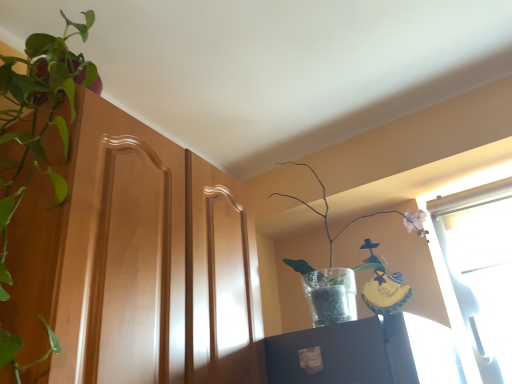
Question: Is translucent glass vase at upper right, the 2th houseplant viewed from the left, surrounding green leafy plant at left, arranged as the 2th houseplant when viewed from the right?

Choices:
 (A) yes
 (B) no

Answer: (B)

Question: Can you confirm if translucent glass vase at upper right, the 2th houseplant viewed from the left, is thinner than green leafy plant at left, arranged as the 2th houseplant when viewed from the right?

Choices:
 (A) yes
 (B) no

Answer: (B)

Question: Is translucent glass vase at upper right, positioned as the first houseplant in right-to-left order, positioned with its back to green leafy plant at left, arranged as the 2th houseplant when viewed from the right?

Choices:
 (A) yes
 (B) no

Answer: (B)

Question: From a real-world perspective, is translucent glass vase at upper right, the 2th houseplant viewed from the left, positioned under green leafy plant at left, the first houseplant positioned from the left, based on gravity?

Choices:
 (A) no
 (B) yes

Answer: (B)

Question: Is translucent glass vase at upper right, positioned as the first houseplant in right-to-left order, next to green leafy plant at left, the first houseplant positioned from the left, and touching it?

Choices:
 (A) yes
 (B) no

Answer: (B)

Question: Based on their sizes in the image, would you say translucent glass vase at upper right, the 2th houseplant viewed from the left, is bigger or smaller than green leafy plant at left, the first houseplant positioned from the left?

Choices:
 (A) big
 (B) small

Answer: (B)

Question: From a real-world perspective, is translucent glass vase at upper right, positioned as the first houseplant in right-to-left order, above or below green leafy plant at left, arranged as the 2th houseplant when viewed from the right?

Choices:
 (A) above
 (B) below

Answer: (B)

Question: Is translucent glass vase at upper right, positioned as the first houseplant in right-to-left order, taller or shorter than green leafy plant at left, the first houseplant positioned from the left?

Choices:
 (A) short
 (B) tall

Answer: (A)

Question: Which is correct: translucent glass vase at upper right, positioned as the first houseplant in right-to-left order, is inside green leafy plant at left, the first houseplant positioned from the left, or outside of it?

Choices:
 (A) inside
 (B) outside

Answer: (B)

Question: In terms of height, does green leafy plant at left, the first houseplant positioned from the left, look taller or shorter compared to translucent glass vase at upper right, the 2th houseplant viewed from the left?

Choices:
 (A) tall
 (B) short

Answer: (A)

Question: From a real-world perspective, is green leafy plant at left, the first houseplant positioned from the left, above or below translucent glass vase at upper right, the 2th houseplant viewed from the left?

Choices:
 (A) above
 (B) below

Answer: (A)

Question: Is green leafy plant at left, the first houseplant positioned from the left, wider or thinner than translucent glass vase at upper right, positioned as the first houseplant in right-to-left order?

Choices:
 (A) thin
 (B) wide

Answer: (A)

Question: Based on their positions, is green leafy plant at left, the first houseplant positioned from the left, located to the left or right of translucent glass vase at upper right, the 2th houseplant viewed from the left?

Choices:
 (A) right
 (B) left

Answer: (B)

Question: In the image, is translucent glass vase at upper right, positioned as the first houseplant in right-to-left order, positioned in front of or behind wooden cabinet at left?

Choices:
 (A) behind
 (B) front

Answer: (A)

Question: Considering the positions of point (x=330, y=240) and point (x=159, y=299), is point (x=330, y=240) closer or farther from the camera than point (x=159, y=299)?

Choices:
 (A) farther
 (B) closer

Answer: (A)